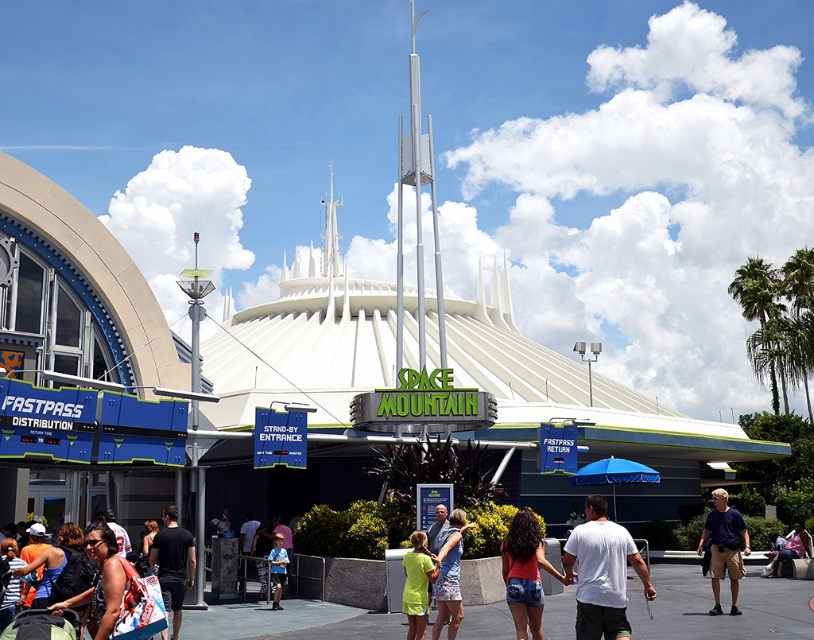
Question: Which object is the closest to the blue denim shorts at center?

Choices:
 (A) neon yellow shirt at center
 (B) pink fabric dress at lower right
 (C) blue fabric shirt at center

Answer: (A)

Question: Can you confirm if white matte t-shirt at lower right is thinner than blue fabric shirt at center?

Choices:
 (A) no
 (B) yes

Answer: (A)

Question: Is the position of white matte t-shirt at lower right more distant than that of silver metallic spire at center?

Choices:
 (A) yes
 (B) no

Answer: (B)

Question: Which object is the closest to the denim shorts at center?

Choices:
 (A) white matte t-shirt at lower right
 (B) silver metallic spire at center

Answer: (A)

Question: Which object is closer to the camera taking this photo?

Choices:
 (A) pink fabric dress at lower right
 (B) blue denim shorts at center

Answer: (B)

Question: Can you confirm if white matte t-shirt at lower right is smaller than blue fabric shirt at center?

Choices:
 (A) no
 (B) yes

Answer: (A)